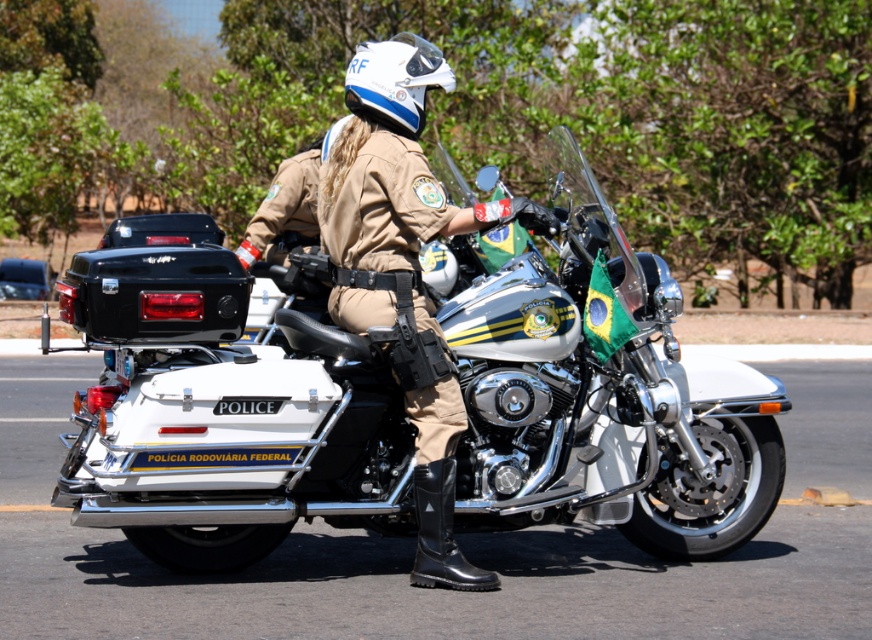
You are standing 20 feet away from the police motorcycle. Is the point at coordinates point (646,452) closer to you or farther away than the motorcycle?

The point at coordinates point (646,452) is farther away than the motorcycle because it is 21.71 feet away from the viewer, which is beyond the 20 feet distance you are standing from the motorcycle.

You are standing at the origin point in the image. The brown leather jacket at center is located at point (405, 268). If you want to move towards the brown leather jacket at center, in which direction should you move?

The brown leather jacket at center is located at point (405, 268), so you should move towards the center of the image to reach it.

You are a police officer who needs to locate the white metallic motorcycle at center in the image. According to the coordinates provided, where should you look?

The white metallic motorcycle at center is located at point coordinates of [603,401].